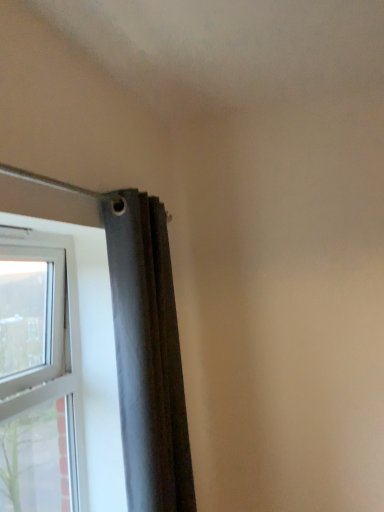
This screenshot has width=384, height=512. I want to click on white plastic window at left, so click(x=49, y=343).

What do you see at coordinates (49, 343) in the screenshot? The height and width of the screenshot is (512, 384). I see `white plastic window at left` at bounding box center [49, 343].

Image resolution: width=384 pixels, height=512 pixels. Describe the element at coordinates (148, 355) in the screenshot. I see `dark gray fabric curtain at upper left` at that location.

Where is `dark gray fabric curtain at upper left`? dark gray fabric curtain at upper left is located at coordinates (148, 355).

Identify the location of white plastic window at left. The image size is (384, 512). (49, 343).

Does dark gray fabric curtain at upper left appear on the left side of white plastic window at left?

No.

Does dark gray fabric curtain at upper left come behind white plastic window at left?

Yes, dark gray fabric curtain at upper left is further from the camera.

From the picture: Which is less distant, (x=137, y=349) or (x=68, y=441)?

Positioned in front is point (x=137, y=349).

From the image's perspective, which object appears higher, dark gray fabric curtain at upper left or white plastic window at left?

dark gray fabric curtain at upper left, from the image's perspective.

From a real-world perspective, who is located higher, dark gray fabric curtain at upper left or white plastic window at left?

dark gray fabric curtain at upper left, from a real-world perspective.

Can you confirm if dark gray fabric curtain at upper left is thinner than white plastic window at left?

No, dark gray fabric curtain at upper left is not thinner than white plastic window at left.

Does dark gray fabric curtain at upper left have a greater height compared to white plastic window at left?

Yes, dark gray fabric curtain at upper left is taller than white plastic window at left.

Does dark gray fabric curtain at upper left have a smaller size compared to white plastic window at left?

No, dark gray fabric curtain at upper left is not smaller than white plastic window at left.

Is dark gray fabric curtain at upper left inside or outside of white plastic window at left?

dark gray fabric curtain at upper left is located beyond the bounds of white plastic window at left.

Consider the image. Are dark gray fabric curtain at upper left and white plastic window at left making contact?

dark gray fabric curtain at upper left and white plastic window at left are clearly separated.

Is white plastic window at left at the back of dark gray fabric curtain at upper left?

Absolutely, dark gray fabric curtain at upper left is directed away from white plastic window at left.

Where is `curtain behind the white plastic window at left`? This screenshot has width=384, height=512. curtain behind the white plastic window at left is located at coordinates (148, 355).

Can you confirm if white plastic window at left is positioned to the right of dark gray fabric curtain at upper left?

Incorrect, white plastic window at left is not on the right side of dark gray fabric curtain at upper left.

Which object is further away from the camera taking this photo, white plastic window at left or dark gray fabric curtain at upper left?

dark gray fabric curtain at upper left is behind.

Does point (21, 385) appear closer or farther from the camera than point (164, 248)?

Point (21, 385) is positioned closer to the camera compared to point (164, 248).

From the image's perspective, which is below, white plastic window at left or dark gray fabric curtain at upper left?

white plastic window at left appears lower in the image.

From a real-world perspective, is white plastic window at left positioned under dark gray fabric curtain at upper left based on gravity?

Yes.

Considering the sizes of objects white plastic window at left and dark gray fabric curtain at upper left in the image provided, who is thinner, white plastic window at left or dark gray fabric curtain at upper left?

Thinner between the two is white plastic window at left.

Does white plastic window at left have a greater height compared to dark gray fabric curtain at upper left?

In fact, white plastic window at left may be shorter than dark gray fabric curtain at upper left.

Does white plastic window at left have a larger size compared to dark gray fabric curtain at upper left?

No.

Which is correct: white plastic window at left is inside dark gray fabric curtain at upper left, or outside of it?

white plastic window at left is not inside dark gray fabric curtain at upper left, it's outside.

Does white plastic window at left touch dark gray fabric curtain at upper left?

No, white plastic window at left is not touching dark gray fabric curtain at upper left.

From the picture: Is white plastic window at left positioned with its back to dark gray fabric curtain at upper left?

No, white plastic window at left is not facing away from dark gray fabric curtain at upper left.

This screenshot has height=512, width=384. In order to click on window below the dark gray fabric curtain at upper left (from the image's perspective) in this screenshot , I will do `click(49, 343)`.

The image size is (384, 512). What are the coordinates of `window that appears on the left of dark gray fabric curtain at upper left` in the screenshot? It's located at (49, 343).

Find the location of a particular element. The image size is (384, 512). window that appears below the dark gray fabric curtain at upper left (from the image's perspective) is located at coordinates (49, 343).